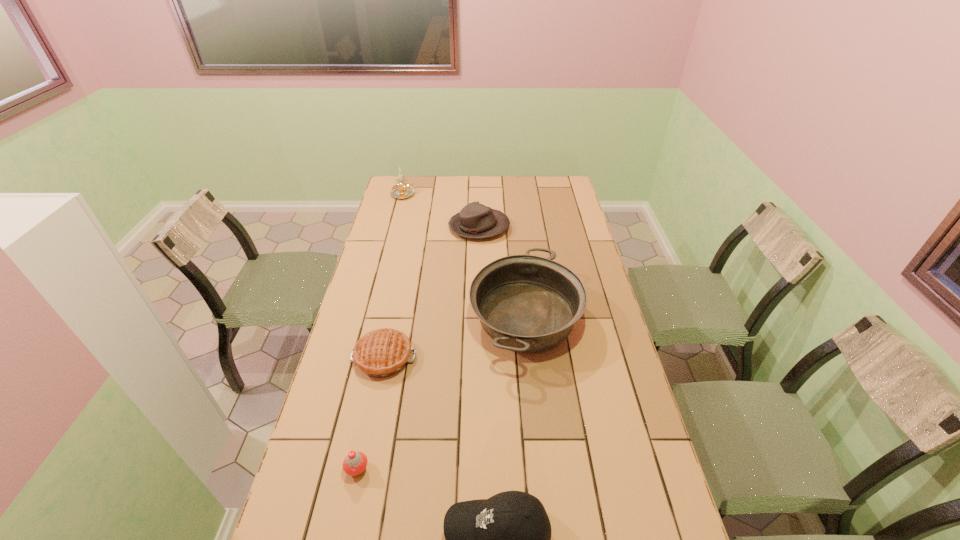
Image resolution: width=960 pixels, height=540 pixels. In order to click on vacant region that satisfies the following two spatial constraints: 1. on the decorative side of the hat; 2. on the left side of the pan in this screenshot , I will do `click(479, 317)`.

This screenshot has height=540, width=960. In order to click on vacant region that satisfies the following two spatial constraints: 1. on the decorative side of the pan; 2. on the left side of the hat in this screenshot , I will do tap(479, 317).

The image size is (960, 540). I want to click on free spot that satisfies the following two spatial constraints: 1. on the decorative side of the pan; 2. on the right side of the fifth nearest object, so [479, 317].

Image resolution: width=960 pixels, height=540 pixels. I want to click on free spot that satisfies the following two spatial constraints: 1. on the back side of the pan; 2. on the left side of the second nearest object, so click(x=390, y=317).